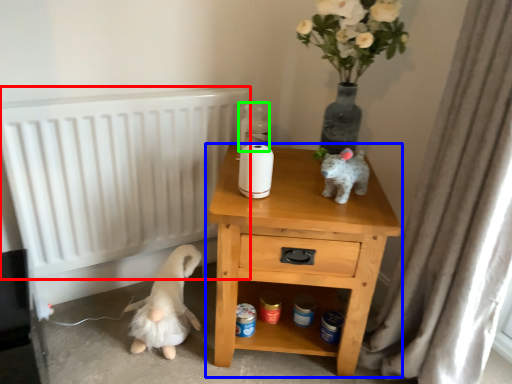
Question: Which object is positioned farthest from radiator (highlighted by a red box)? Select from nightstand (highlighted by a blue box) and bottle (highlighted by a green box).

Choices:
 (A) nightstand
 (B) bottle

Answer: (A)